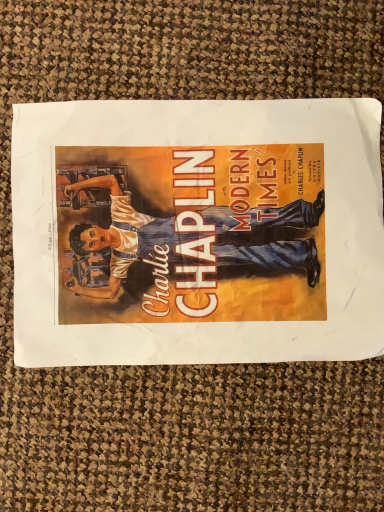
Describe the element at coordinates (197, 232) in the screenshot. I see `matte paper poster at center` at that location.

You are a GUI agent. You are given a task and a screenshot of the screen. Output one action in this format:
    pyautogui.click(x=<x>, y=<y>)
    Task: Click on the matte paper poster at center
    
    Given the screenshot: What is the action you would take?
    pyautogui.click(x=197, y=232)

In the scene shown: Measure the distance between point (96, 331) and camera.

Point (96, 331) and camera are 13.23 inches apart from each other.

The width and height of the screenshot is (384, 512). Find the location of `matte paper poster at center`. matte paper poster at center is located at coordinates (197, 232).